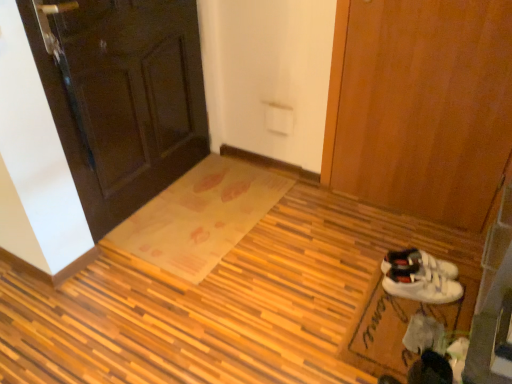
The image size is (512, 384). Find the location of `vacant space to the left of wooden door at right, marked as the first door in a right-to-left arrangement`. vacant space to the left of wooden door at right, marked as the first door in a right-to-left arrangement is located at coordinates (327, 220).